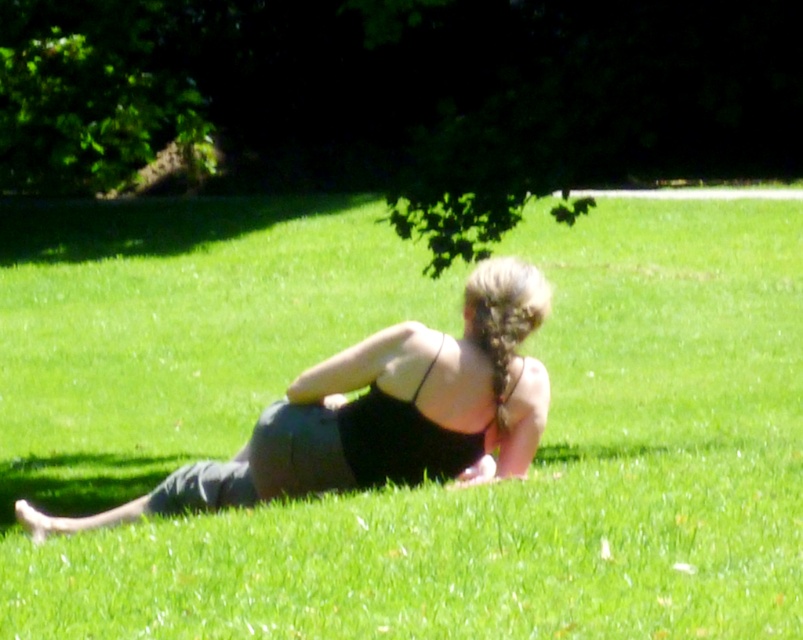
Can you confirm if green grassy at center is smaller than green leafy tree at upper center?

Yes.

Can you confirm if green grassy at center is positioned to the left of green leafy tree at upper center?

Indeed, green grassy at center is positioned on the left side of green leafy tree at upper center.

Which is in front, point (426, 586) or point (687, 124)?

Point (426, 586) is more forward.

Locate an element on the screen. green grassy at center is located at coordinates (402, 490).

Which of these two, black fabric tank top at center or black matte bikini top at center, stands taller?

Standing taller between the two is black fabric tank top at center.

Does point (365, 419) lie behind point (377, 420)?

That is False.

At what (x,y) coordinates should I click in order to perform the action: click on black fabric tank top at center. Please return your answer as a coordinate pair (x, y). Looking at the image, I should click on (380, 413).

Is black fabric tank top at center smaller than green leafy tree at upper left?

Correct, black fabric tank top at center occupies less space than green leafy tree at upper left.

Looking at this image, between black fabric tank top at center and green leafy tree at upper left, which one has less height?

With less height is black fabric tank top at center.

Measure the distance between point (353, 429) and camera.

Point (353, 429) is 7.28 meters away from camera.

Find the location of `black fabric tank top at center`. black fabric tank top at center is located at coordinates (380, 413).